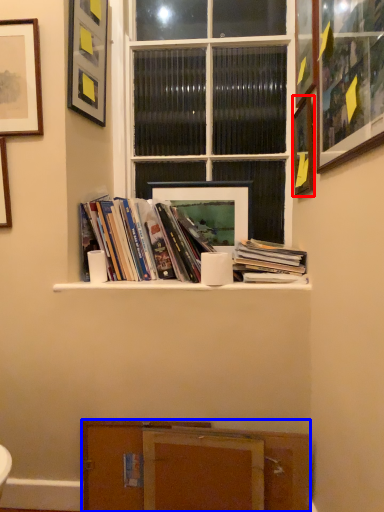
Question: Which point is closer to the camera, picture frame (highlighted by a red box) or cabinetry (highlighted by a blue box)?

Choices:
 (A) picture frame
 (B) cabinetry

Answer: (B)